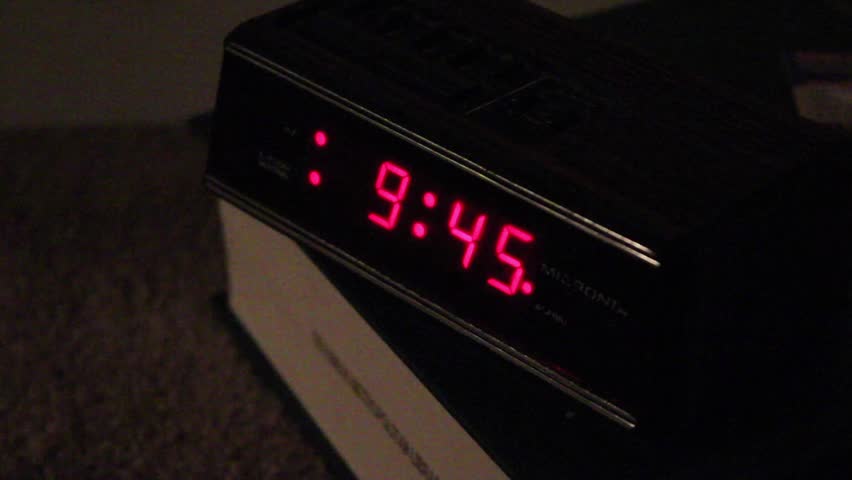
The width and height of the screenshot is (852, 480). I want to click on cord, so click(x=193, y=125).